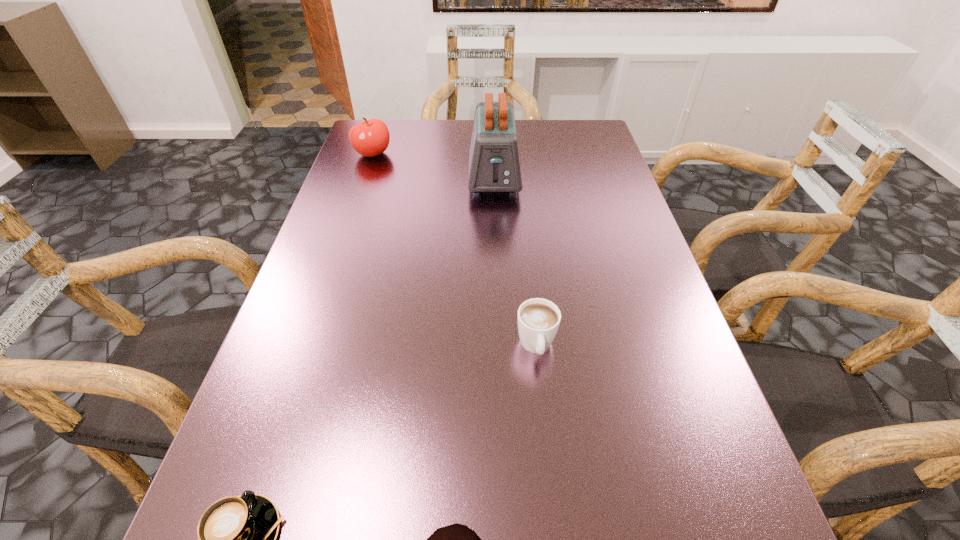
The height and width of the screenshot is (540, 960). What are the coordinates of `toaster` in the screenshot? It's located at (494, 166).

You are a GUI agent. You are given a task and a screenshot of the screen. Output one action in this format:
    pyautogui.click(x=<x>, y=<y>)
    Task: Click on the second tallest object
    This screenshot has height=540, width=960.
    Given the screenshot: What is the action you would take?
    pyautogui.click(x=370, y=138)

You are a GUI agent. You are given a task and a screenshot of the screen. Output one action in this format:
    pyautogui.click(x=<x>, y=<y>)
    Task: Click on the farther cappuccino
    This screenshot has width=960, height=540.
    Given the screenshot: What is the action you would take?
    pyautogui.click(x=538, y=319)

The image size is (960, 540). Identify the location of the taller cappuccino. (538, 319).

Identify the location of blank space located 0.090m on the front-facing side of the tallest object. (496, 225).

The image size is (960, 540). What are the coordinates of `vacant area situated on the front of the apple` in the screenshot? It's located at (351, 217).

Identify the location of vacant space located with the handle on the side of the taller cappuccino. (550, 470).

The width and height of the screenshot is (960, 540). In order to click on toaster that is at the far edge in this screenshot , I will do `click(494, 166)`.

Locate an element on the screen. This screenshot has height=540, width=960. apple present at the far edge is located at coordinates point(370,138).

Image resolution: width=960 pixels, height=540 pixels. What are the coordinates of `object positioned at the left edge` in the screenshot? It's located at (370, 138).